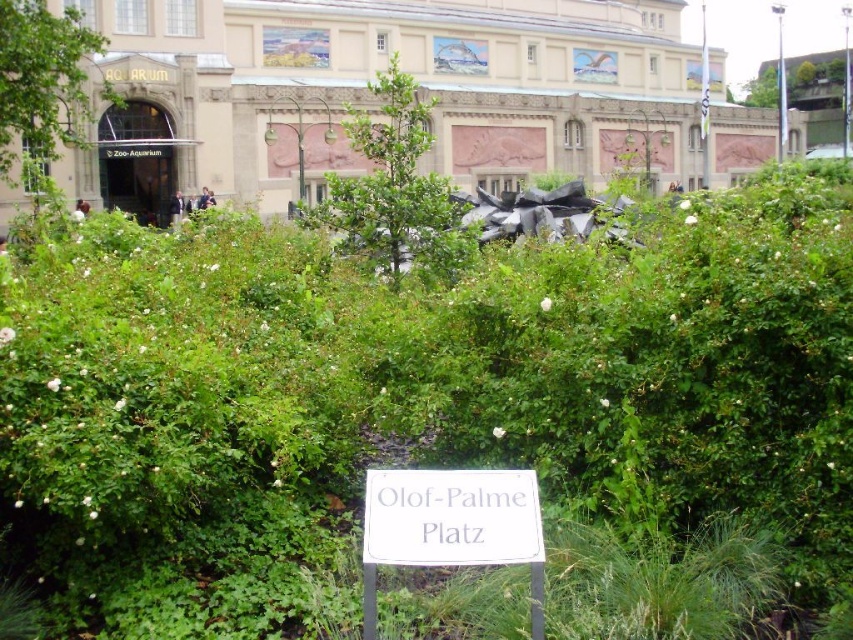
Question: In this image, where is green leafy bush at center located relative to white plastic sign at center?

Choices:
 (A) right
 (B) left

Answer: (B)

Question: Among these objects, which one is nearest to the camera?

Choices:
 (A) green leafy bush at center
 (B) white plastic sign at center

Answer: (B)

Question: Which object is closer to the camera taking this photo?

Choices:
 (A) green leafy bush at center
 (B) white plastic sign at center

Answer: (B)

Question: Is green leafy bush at center behind white plastic sign at center?

Choices:
 (A) no
 (B) yes

Answer: (B)

Question: Is green leafy bush at center behind white plastic sign at center?

Choices:
 (A) no
 (B) yes

Answer: (B)